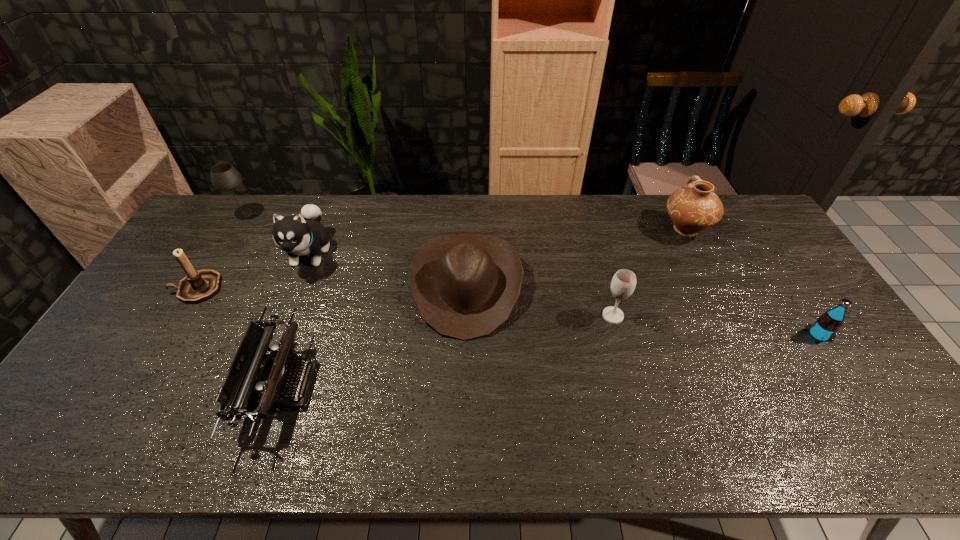
Locate an element on the screen. Image resolution: width=960 pixels, height=540 pixels. object positioned at the near edge is located at coordinates (252, 370).

Find the location of a particular element. The image size is (960, 540). wineglass present at the left edge is located at coordinates (224, 177).

The height and width of the screenshot is (540, 960). I want to click on candle holder that is at the left edge, so click(x=197, y=286).

This screenshot has height=540, width=960. Find the location of `object that is positioned at the right edge`. object that is positioned at the right edge is located at coordinates (824, 329).

This screenshot has height=540, width=960. Find the location of `object located in the far left corner section of the desktop`. object located in the far left corner section of the desktop is located at coordinates (224, 177).

Image resolution: width=960 pixels, height=540 pixels. In order to click on vacant region at the far edge of the desktop in this screenshot , I will do `click(634, 207)`.

Find the location of a particular element. This screenshot has width=960, height=540. free spot at the near edge of the desktop is located at coordinates (213, 440).

Find the location of `free space at the left edge of the desktop`. free space at the left edge of the desktop is located at coordinates (227, 244).

Locate an element on the screen. vacant space at the right edge is located at coordinates (766, 274).

In the image, there is a desktop. Where is `vacant space at the far left corner`? The image size is (960, 540). vacant space at the far left corner is located at coordinates (225, 202).